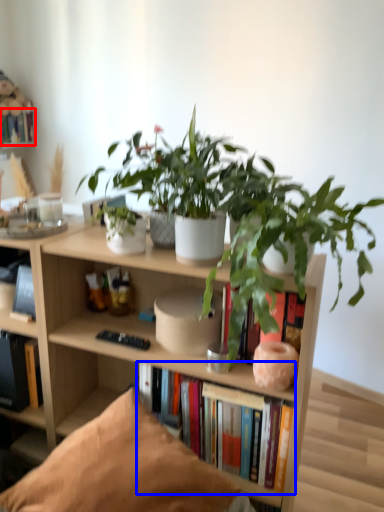
Question: Which point is further to the camera, book (highlighted by a red box) or book (highlighted by a blue box)?

Choices:
 (A) book
 (B) book

Answer: (A)